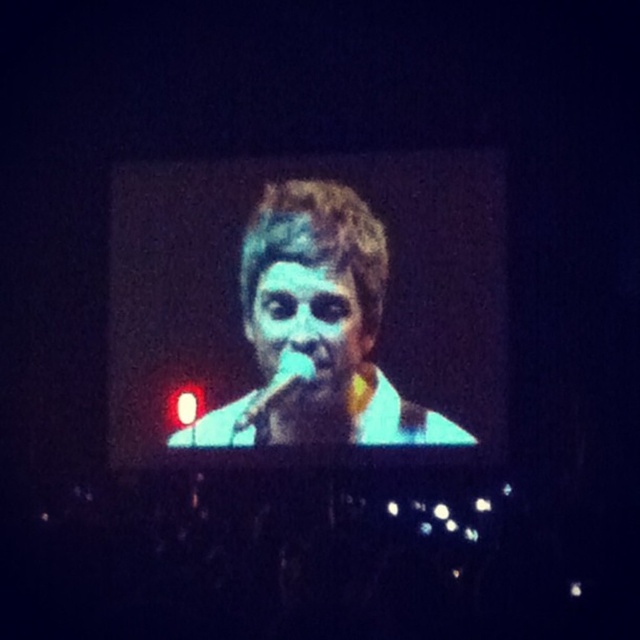
You are a photographer adjusting the focus of your camera. You notice a point at coordinates (x=316, y=330) on the screen. What is the subject at this point?

The point at coordinates (x=316, y=330) corresponds to blue tinted skin at center.